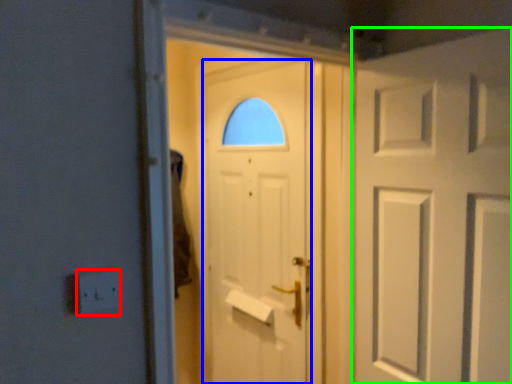
Question: Based on their relative distances, which object is farther from electric outlet (highlighted by a red box)? Choose from door (highlighted by a blue box) and door (highlighted by a green box).

Choices:
 (A) door
 (B) door

Answer: (A)